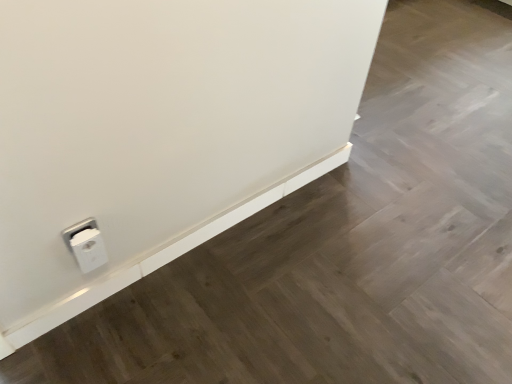
Question: In the image, is white plastic ledge at lower left positioned in front of or behind white plastic power plug at lower left?

Choices:
 (A) behind
 (B) front

Answer: (A)

Question: Based on their sizes in the image, would you say white plastic ledge at lower left is bigger or smaller than white plastic power plug at lower left?

Choices:
 (A) big
 (B) small

Answer: (A)

Question: Is white plastic ledge at lower left spatially inside white plastic power plug at lower left, or outside of it?

Choices:
 (A) outside
 (B) inside

Answer: (A)

Question: From their relative heights in the image, would you say white plastic power plug at lower left is taller or shorter than white plastic ledge at lower left?

Choices:
 (A) tall
 (B) short

Answer: (A)

Question: In the image, is white plastic power plug at lower left positioned in front of or behind white plastic ledge at lower left?

Choices:
 (A) front
 (B) behind

Answer: (A)

Question: Looking at the image, does white plastic power plug at lower left seem bigger or smaller compared to white plastic ledge at lower left?

Choices:
 (A) big
 (B) small

Answer: (B)

Question: Considering the positions of white plastic power plug at lower left and white plastic ledge at lower left in the image, is white plastic power plug at lower left wider or thinner than white plastic ledge at lower left?

Choices:
 (A) wide
 (B) thin

Answer: (A)